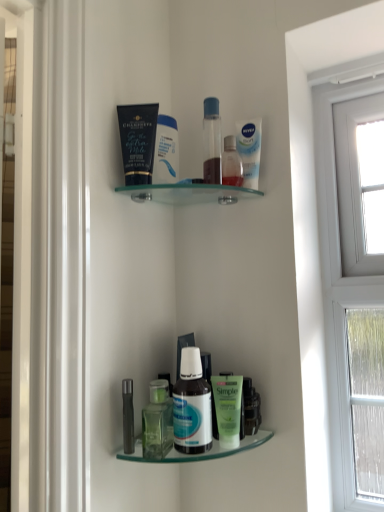
This screenshot has width=384, height=512. Find the location of `green matte bottle at lower center, the second bottle from the right`. green matte bottle at lower center, the second bottle from the right is located at coordinates (157, 421).

Measure the distance between green matte lotion at lower center, the 3th toiletry from the top, and camera.

The depth of green matte lotion at lower center, the 3th toiletry from the top, is 27.84 inches.

This screenshot has height=512, width=384. In order to click on white glossy bottle at lower center, which is the first bottle in right-to-left order in this screenshot , I will do `click(192, 406)`.

Locate an element on the screen. shelf lying below the matte black tube at upper center (from the image's perspective) is located at coordinates point(198,454).

Is translucent glass bottles at lower center oriented away from matte black tube at upper center?

No.

From the image's perspective, between translucent glass bottles at lower center and matte black tube at upper center, which one is located above?

matte black tube at upper center, from the image's perspective.

Who is smaller, metallic silver tube at lower left, which ranks as the fourth toiletry in top-to-bottom order, or translucent plastic bottle at upper center, which is the 4th toiletry in left-to-right order?

metallic silver tube at lower left, which ranks as the fourth toiletry in top-to-bottom order, is smaller.

In the image, is metallic silver tube at lower left, the 4th toiletry from the right, positioned in front of or behind translucent plastic bottle at upper center, the second toiletry viewed from the top?

metallic silver tube at lower left, the 4th toiletry from the right, is in front of translucent plastic bottle at upper center, the second toiletry viewed from the top.

Is metallic silver tube at lower left, which ranks as the fourth toiletry in top-to-bottom order, turned away from translucent plastic bottle at upper center, which is the 4th toiletry in left-to-right order?

metallic silver tube at lower left, which ranks as the fourth toiletry in top-to-bottom order, is not turned away from translucent plastic bottle at upper center, which is the 4th toiletry in left-to-right order.

Are metallic silver tube at lower left, the first toiletry when ordered from left to right, and white glossy bottle at lower center, which ranks as the second bottle in left-to-right order, beside each other?

No, metallic silver tube at lower left, the first toiletry when ordered from left to right, is not next to white glossy bottle at lower center, which ranks as the second bottle in left-to-right order.

Between metallic silver tube at lower left, the 4th toiletry from the right, and white glossy bottle at lower center, which ranks as the second bottle in left-to-right order, which one appears on the right side from the viewer's perspective?

Answer: Positioned to the right is white glossy bottle at lower center, which ranks as the second bottle in left-to-right order.

From a real-world perspective, is metallic silver tube at lower left, which is the 1th toiletry from bottom to top, physically located above or below white glossy bottle at lower center, which ranks as the second bottle in left-to-right order?

From a real-world perspective, metallic silver tube at lower left, which is the 1th toiletry from bottom to top, is physically below white glossy bottle at lower center, which ranks as the second bottle in left-to-right order.

From a real-world perspective, relative to metallic silver tube at lower left, which is the 1th toiletry from bottom to top, is matte black tube at upper center vertically above or below?

In terms of real-world spatial position, matte black tube at upper center is above metallic silver tube at lower left, which is the 1th toiletry from bottom to top.

Can you confirm if matte black tube at upper center is taller than metallic silver tube at lower left, which is the 1th toiletry from bottom to top?

Yes, matte black tube at upper center is taller than metallic silver tube at lower left, which is the 1th toiletry from bottom to top.

Looking at this image, is matte black tube at upper center wider than metallic silver tube at lower left, the first toiletry when ordered from left to right?

Correct, the width of matte black tube at upper center exceeds that of metallic silver tube at lower left, the first toiletry when ordered from left to right.

How far apart are green matte lotion at lower center, which is the 3th toiletry in left-to-right order, and transparent plastic bottle at upper center, the 4th toiletry in the bottom-to-top sequence?

green matte lotion at lower center, which is the 3th toiletry in left-to-right order, and transparent plastic bottle at upper center, the 4th toiletry in the bottom-to-top sequence, are 17.23 inches apart.

Is green matte lotion at lower center, which is counted as the 2th toiletry, starting from the bottom, directly adjacent to transparent plastic bottle at upper center, the 1th toiletry viewed from the top?

No, green matte lotion at lower center, which is counted as the 2th toiletry, starting from the bottom, is not beside transparent plastic bottle at upper center, the 1th toiletry viewed from the top.

Can you confirm if green matte lotion at lower center, the 3th toiletry from the top, is thinner than transparent plastic bottle at upper center, the 4th toiletry in the bottom-to-top sequence?

Incorrect, the width of green matte lotion at lower center, the 3th toiletry from the top, is not less than that of transparent plastic bottle at upper center, the 4th toiletry in the bottom-to-top sequence.

Is translucent glass bottles at lower center surrounded by dark blue matte tube at upper left, the first mouthwash from the left?

No, translucent glass bottles at lower center is not surrounded by dark blue matte tube at upper left, the first mouthwash from the left.

Is dark blue matte tube at upper left, the 1th mouthwash from the front, further to camera compared to translucent glass bottles at lower center?

Yes, it is behind translucent glass bottles at lower center.

Which is nearer, (126, 126) or (121, 453)?

Positioned in front is point (121, 453).

Is green matte lotion at lower center, which is the 3th toiletry in left-to-right order, located outside matte black tube at upper center?

green matte lotion at lower center, which is the 3th toiletry in left-to-right order, is positioned outside matte black tube at upper center.

Between green matte lotion at lower center, which is the 3th toiletry in left-to-right order, and matte black tube at upper center, which one appears on the right side from the viewer's perspective?

green matte lotion at lower center, which is the 3th toiletry in left-to-right order.

From a real-world perspective, which object stands above the other?

From a 3D spatial view, matte black tube at upper center is above.

Image resolution: width=384 pixels, height=512 pixels. Identify the location of cleaning product on the left of the green matte lotion at lower center, which is counted as the 2th toiletry, starting from the bottom. (166, 151).

You are a GUI agent. You are given a task and a screenshot of the screen. Output one action in this format:
    pyautogui.click(x=<x>, y=<y>)
    Task: Click on the shelf that is in front of the matte black tube at upper center
    The image size is (384, 512).
    Given the screenshot: What is the action you would take?
    pyautogui.click(x=198, y=454)

Where is `toiletry that is the 2nd one below the translucent plastic bottle at upper center, the second toiletry viewed from the top (from a real-world perspective)`? Image resolution: width=384 pixels, height=512 pixels. toiletry that is the 2nd one below the translucent plastic bottle at upper center, the second toiletry viewed from the top (from a real-world perspective) is located at coordinates (128, 416).

When comparing their distances from matte black tube at upper center, does metallic silver tube at lower left, the first toiletry when ordered from left to right, or green matte lotion at lower center, the 2th toiletry from the right, seem closer?

metallic silver tube at lower left, the first toiletry when ordered from left to right, is closer to matte black tube at upper center.

Consider the image. Considering their positions, is translucent plastic bottle at upper center, the 3th toiletry ordered from the bottom, positioned further to dark blue matte tube at upper left, the first mouthwash from the left, than green matte bottle at lower center, which is the first bottle from left to right?

Based on the image, green matte bottle at lower center, which is the first bottle from left to right, appears to be further to dark blue matte tube at upper left, the first mouthwash from the left.

When comparing their distances from white glossy bottle at lower center, which is the first bottle in right-to-left order, does dark blue matte tube at upper left, arranged as the second mouthwash when viewed from the right, or translucent glass bottles at lower center seem further?

dark blue matte tube at upper left, arranged as the second mouthwash when viewed from the right, is further to white glossy bottle at lower center, which is the first bottle in right-to-left order.

Looking at the image, which one is located further to green matte bottle at lower center, the second bottle from the right, transparent plastic bottle at upper center, the third toiletry from the right, or white glossy mouthwash at upper center, marked as the second mouthwash in a left-to-right arrangement?

transparent plastic bottle at upper center, the third toiletry from the right, is further to green matte bottle at lower center, the second bottle from the right.

When comparing their distances from transparent plastic bottle at upper center, the 4th toiletry in the bottom-to-top sequence, does matte black tube at upper center or white glossy bottle at lower center, which ranks as the second bottle in left-to-right order, seem further?

white glossy bottle at lower center, which ranks as the second bottle in left-to-right order, lies further to transparent plastic bottle at upper center, the 4th toiletry in the bottom-to-top sequence, than the other object.

When comparing their distances from transparent plastic bottle at upper center, the second toiletry when ordered from left to right, does translucent glass bottles at lower center or white glossy bottle at lower center, which is the first bottle in right-to-left order, seem further?

Based on the image, translucent glass bottles at lower center appears to be further to transparent plastic bottle at upper center, the second toiletry when ordered from left to right.

Estimate the real-world distances between objects in this image. Which object is further from matte black tube at upper center, white glossy bottle at lower center, which ranks as the second bottle in left-to-right order, or metallic silver tube at lower left, the 4th toiletry from the right?

Among the two, metallic silver tube at lower left, the 4th toiletry from the right, is located further to matte black tube at upper center.

Considering their positions, is dark blue matte tube at upper left, which is the second mouthwash from back to front, positioned further to green matte bottle at lower center, which is the first bottle from left to right, than white glossy bottle at lower center, which ranks as the second bottle in left-to-right order?

dark blue matte tube at upper left, which is the second mouthwash from back to front, is further to green matte bottle at lower center, which is the first bottle from left to right.

Locate an element on the screen. Image resolution: width=384 pixels, height=512 pixels. bottle between white glossy mouthwash at upper center, marked as the second mouthwash in a left-to-right arrangement, and green matte lotion at lower center, the 3th toiletry from the top, vertically is located at coordinates (192, 406).

This screenshot has width=384, height=512. In order to click on mouthwash that lies between matte black tube at upper center and metallic silver tube at lower left, which is the 1th toiletry from bottom to top, from top to bottom in this screenshot , I will do pyautogui.click(x=249, y=150).

I want to click on toiletry between white glossy mouthwash at upper center, the 1th mouthwash positioned from the back, and green matte lotion at lower center, the 2th toiletry from the right, from top to bottom, so click(x=231, y=163).

I want to click on cleaning product between dark blue matte tube at upper left, the 1th mouthwash from the front, and translucent plastic bottle at upper center, the second toiletry viewed from the top, so click(x=166, y=151).